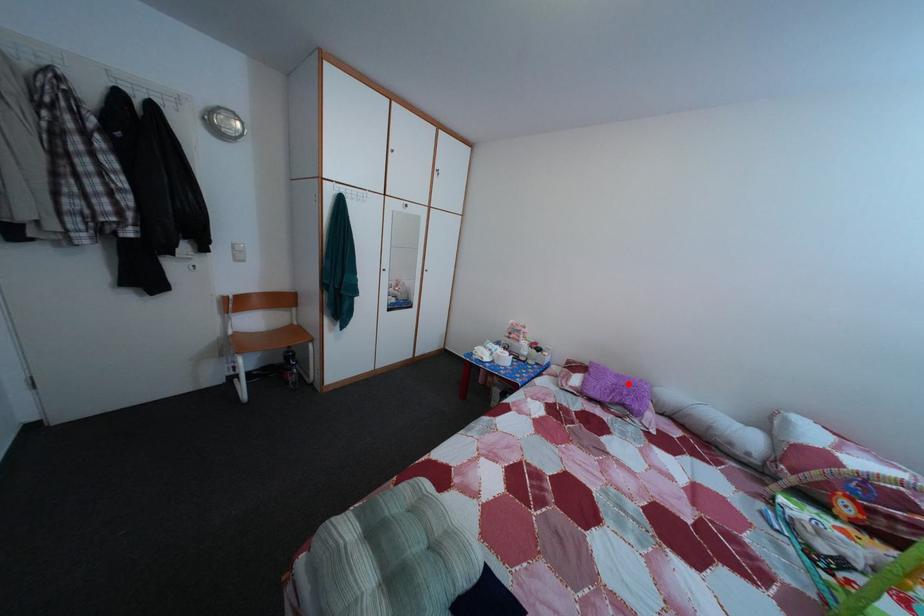
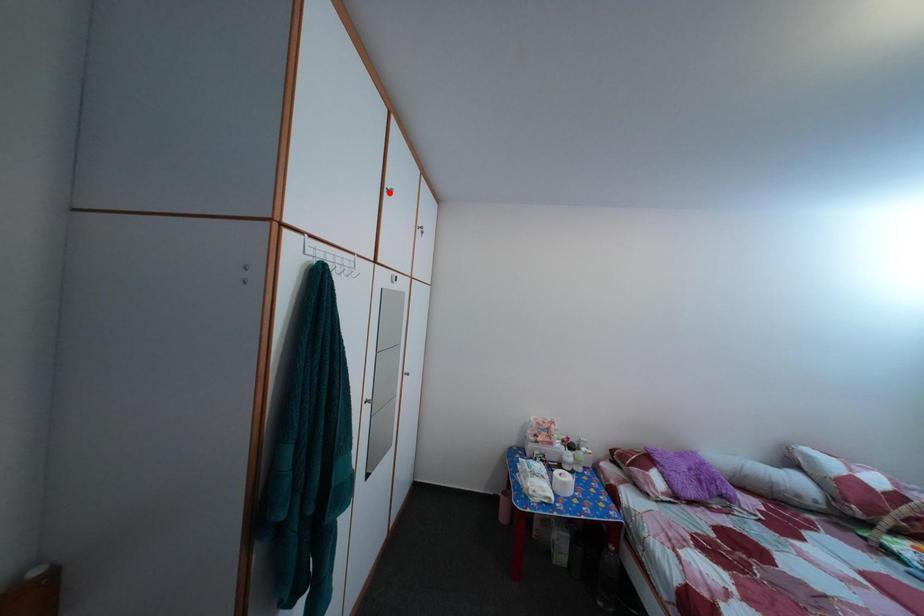
I am providing you with two images of the same scene from different viewpoints. A red point is marked on the first image and another point is marked on the second image. Is the red point in image1 aligned with the point shown in image2?

No